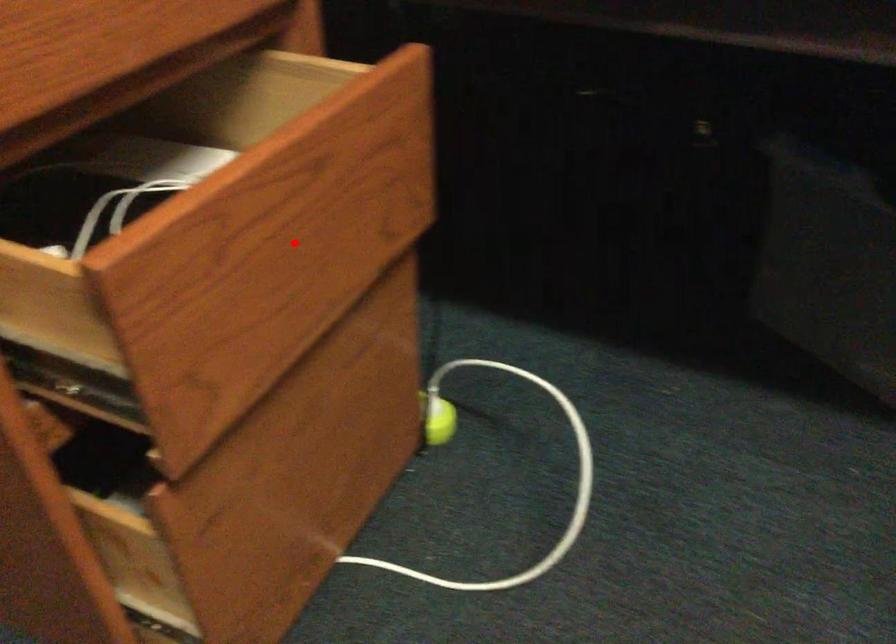
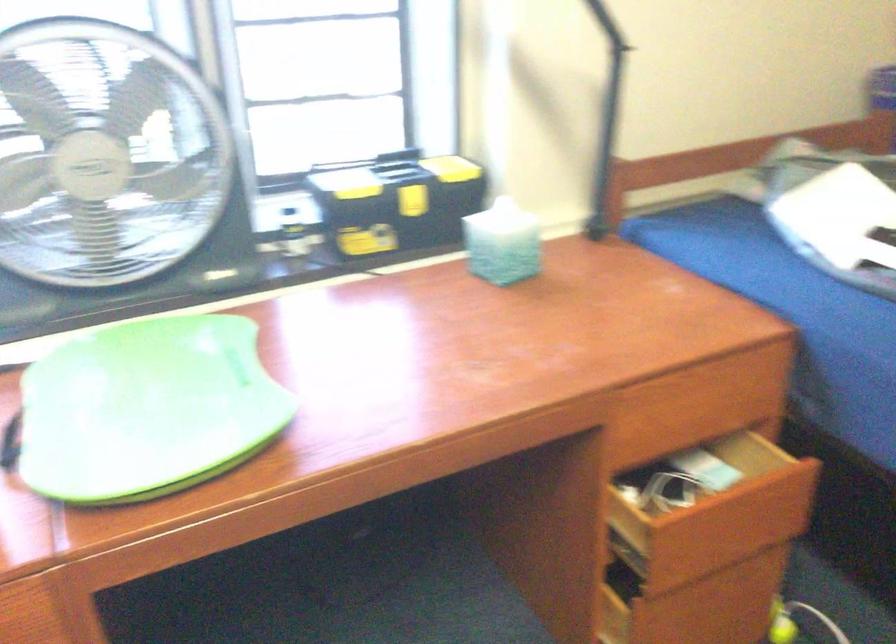
Where in the second image is the point corresponding to the highlighted location from the first image?

(721, 526)